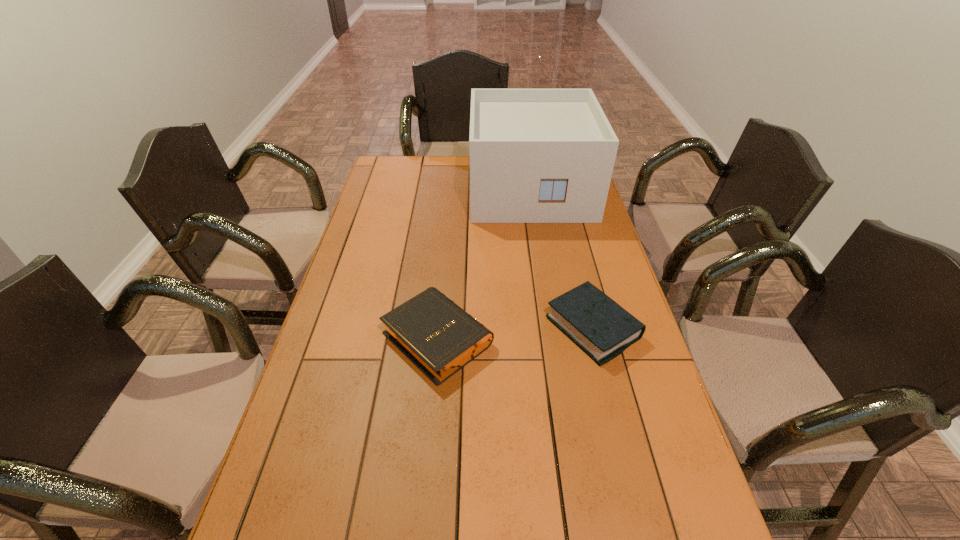
You are a GUI agent. You are given a task and a screenshot of the screen. Output one action in this format:
    pyautogui.click(x=<x>, y=<y>)
    Task: Click on the vacant space that is in between the box and the left Bible
    
    Given the screenshot: What is the action you would take?
    pyautogui.click(x=484, y=263)

This screenshot has height=540, width=960. I want to click on empty location between the left Bible and the right Bible, so click(516, 332).

Where is `object that can be found as the closest to the left Bible`? object that can be found as the closest to the left Bible is located at coordinates (603, 329).

Find the location of `object that stands as the closest to the left Bible`. object that stands as the closest to the left Bible is located at coordinates (603, 329).

In order to click on vacant region that satisfies the following two spatial constraints: 1. on the side of the right Bible with the window; 2. on the left side of the tallest object in this screenshot , I will do `click(553, 328)`.

Locate an element on the screen. The width and height of the screenshot is (960, 540). vacant point that satisfies the following two spatial constraints: 1. on the side of the box with the window; 2. on the left side of the right Bible is located at coordinates (553, 328).